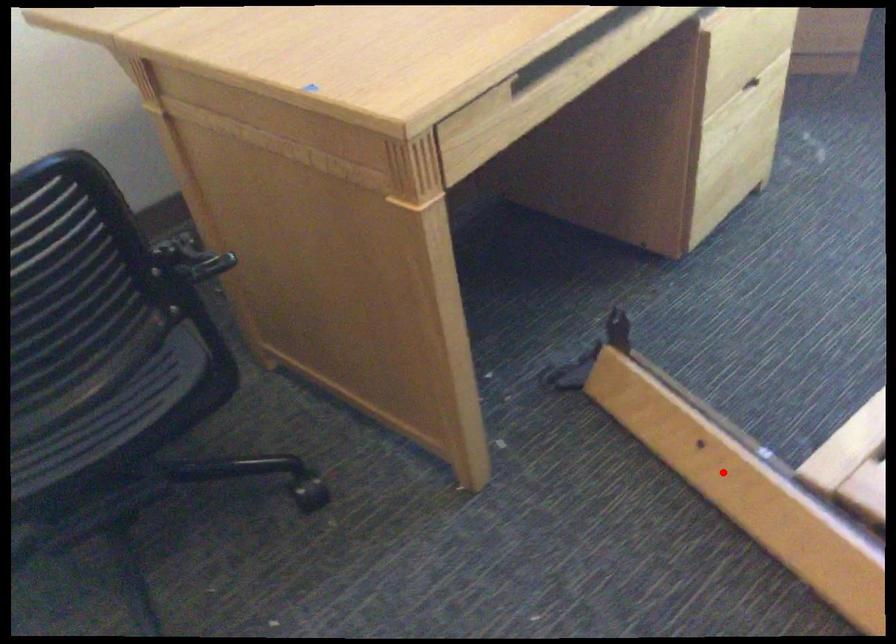
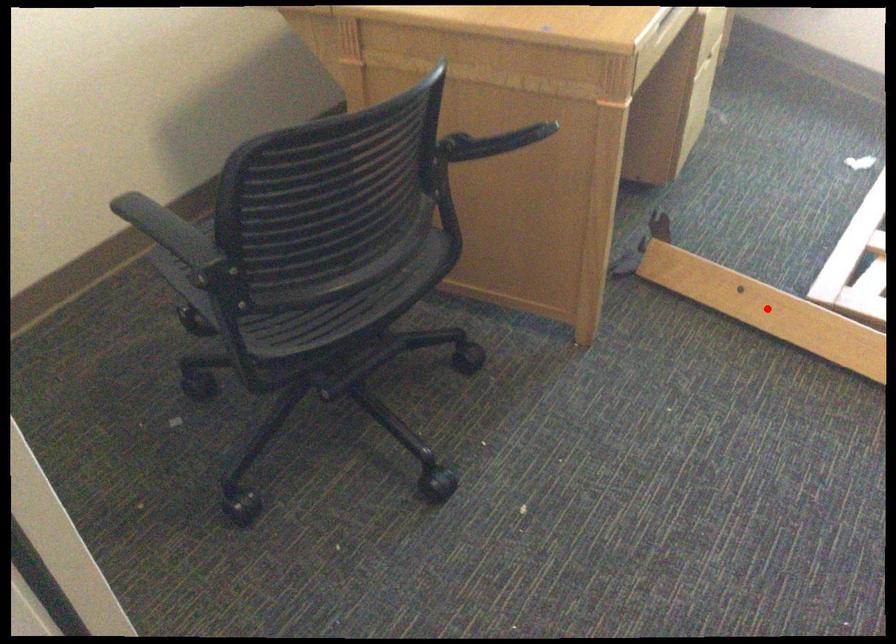
I am providing you with two images of the same scene from different viewpoints. A red point is marked on the first image and another point is marked on the second image. Does the point marked in image1 correspond to the same location as the one in image2?

Yes